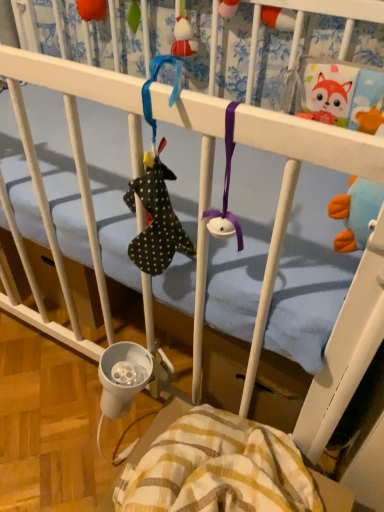
Question: In the image, is orange fabric toy at upper left, which is the 2th toy in right-to-left order, positioned in front of or behind matte red plush toy at upper center, which ranks as the second toy in left-to-right order?

Choices:
 (A) behind
 (B) front

Answer: (A)

Question: From their relative heights in the image, would you say orange fabric toy at upper left, positioned as the first toy in left-to-right order, is taller or shorter than matte red plush toy at upper center, which ranks as the second toy in left-to-right order?

Choices:
 (A) tall
 (B) short

Answer: (B)

Question: Estimate the real-world distances between objects in this image. Which object is closer to the orange fabric toy at upper left, positioned as the first toy in left-to-right order?

Choices:
 (A) yellow striped fabric at lower center
 (B) matte red plush toy at upper center, the first toy positioned from the right

Answer: (B)

Question: Estimate the real-world distances between objects in this image. Which object is farther from the orange fabric toy at upper left, which is the 2th toy in right-to-left order?

Choices:
 (A) yellow striped fabric at lower center
 (B) matte red plush toy at upper center, the first toy positioned from the right

Answer: (A)